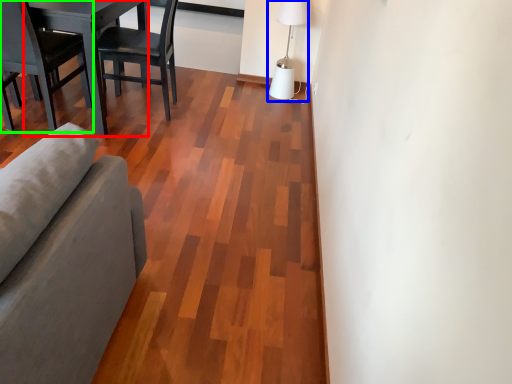
Question: Which object is positioned farthest from table (highlighted by a red box)? Select from table lamp (highlighted by a blue box) and chair (highlighted by a green box).

Choices:
 (A) table lamp
 (B) chair

Answer: (A)